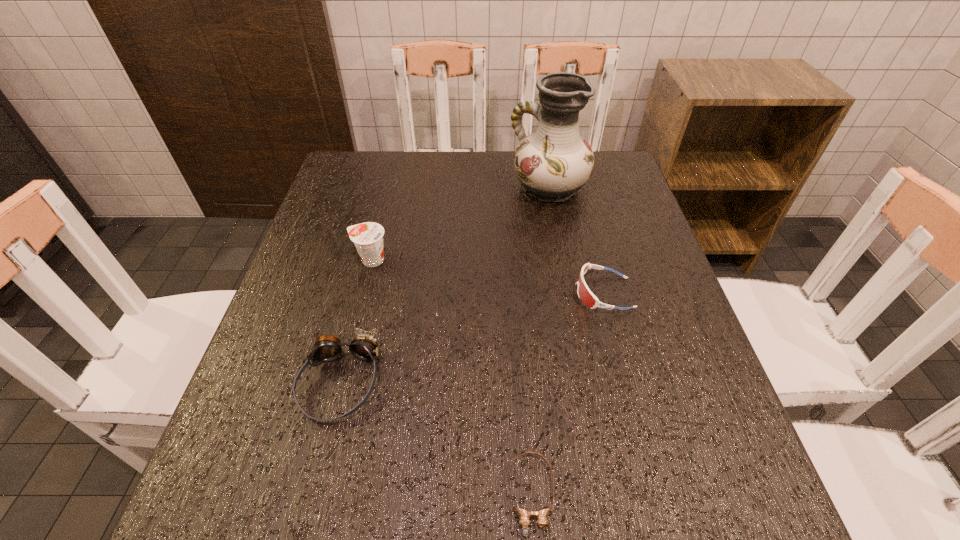
Locate an element on the screen. blank area located 0.260m on the left of the tallest object is located at coordinates (416, 188).

This screenshot has height=540, width=960. In order to click on blank area located on the front of the fourth shortest object in this screenshot , I will do `click(348, 352)`.

Locate an element on the screen. vacant region located 0.070m through the lenses of the second nearest goggles is located at coordinates (319, 467).

Identify the location of free space located 0.180m on the front-facing side of the third nearest object. (492, 293).

Find the location of a particular element. free point located 0.360m on the front-facing side of the third nearest object is located at coordinates (409, 293).

The image size is (960, 540). I want to click on vacant point located on the front-facing side of the third nearest object, so click(519, 293).

The height and width of the screenshot is (540, 960). In order to click on object positioned at the far edge in this screenshot , I will do `click(553, 163)`.

Where is `object located at the near edge`? Image resolution: width=960 pixels, height=540 pixels. object located at the near edge is located at coordinates (524, 516).

Where is `yogurt at the left edge`? yogurt at the left edge is located at coordinates (368, 237).

Locate an element on the screen. The height and width of the screenshot is (540, 960). goggles located in the left edge section of the desktop is located at coordinates (327, 348).